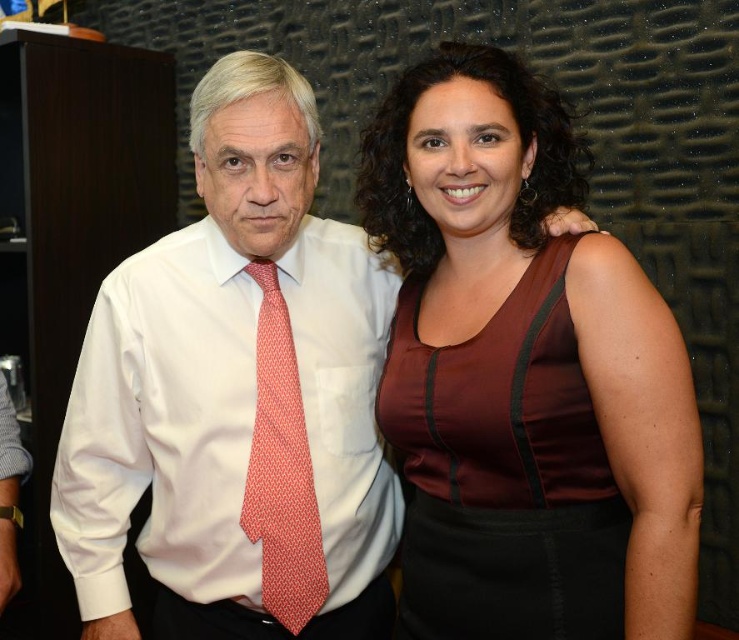
Image resolution: width=739 pixels, height=640 pixels. Describe the element at coordinates (234, 394) in the screenshot. I see `white satin shirt at center` at that location.

In order to click on white satin shirt at center in this screenshot , I will do `click(234, 394)`.

What do you see at coordinates (522, 376) in the screenshot?
I see `burgundy satin dress at center` at bounding box center [522, 376].

Does point (689, 461) come farther from viewer compared to point (286, 381)?

That is False.

Locate an element on the screen. burgundy satin dress at center is located at coordinates (522, 376).

Is burgundy satin dress at center thinner than white smooth dress shirt at left?

Indeed, burgundy satin dress at center has a lesser width compared to white smooth dress shirt at left.

Can you confirm if burgundy satin dress at center is wider than white smooth dress shirt at left?

In fact, burgundy satin dress at center might be narrower than white smooth dress shirt at left.

Who is more forward, (534,605) or (81,468)?

Point (534,605) is more forward.

Find the location of a particular element. The width and height of the screenshot is (739, 640). burgundy satin dress at center is located at coordinates (522, 376).